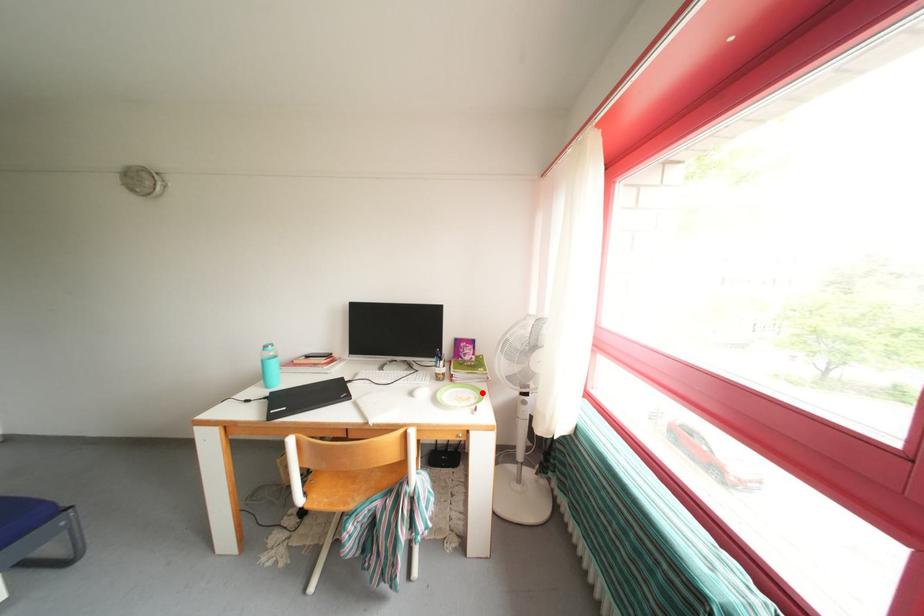
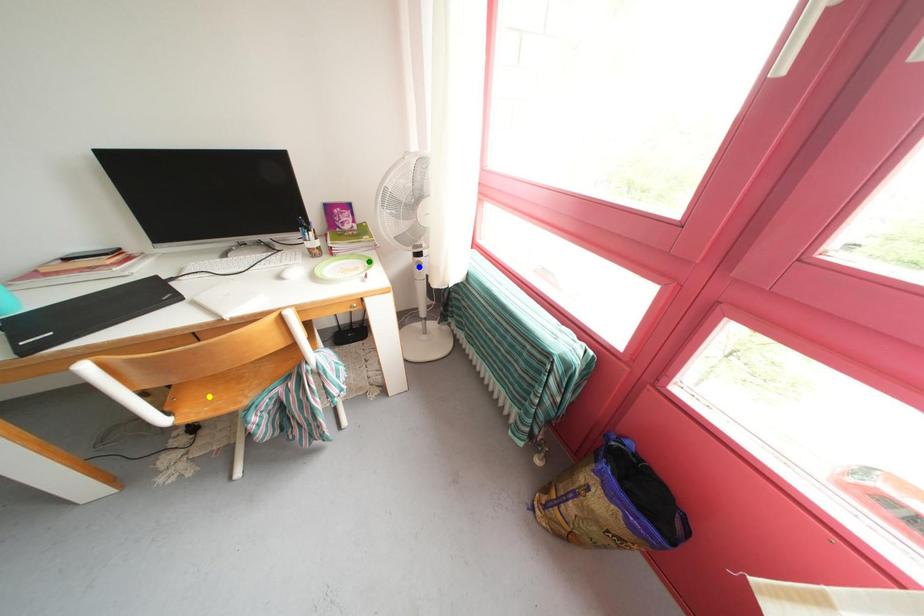
Question: I am providing you with two images of the same scene from different viewpoints. A red point is marked on the first image. You are given multiple points on the second image. In image 2, which mark is for the same physical point as the one in image 1?

Choices:
 (A) green point
 (B) yellow point
 (C) blue point

Answer: (A)